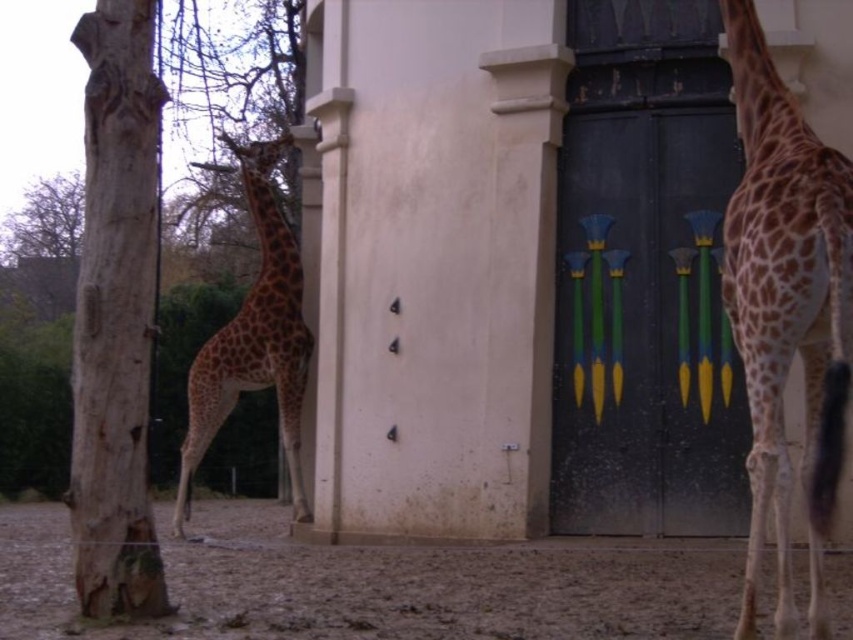
You are a zookeeper standing at the entrance of the building with the dark metal door. You need to locate the spotted brown giraffe at right. Based on its 2D coordinates, in which general direction should you look to find it?

The spotted brown giraffe at right is located at coordinates 0.483 on the x axis and 0.923 on the y axis. Since the x coordinate is closer to 0.5, it is positioned to the right side of the image. The y coordinate is closer to 1, meaning it is near the bottom of the image. Therefore, you should look to the right and slightly downward to locate the spotted brown giraffe at right.

You are a zookeeper trying to feed the giraffes. You have a bucket of food and are standing in front of the building with the distinctive door. Which giraffe is closer to the building wall? The spotted brown giraffe at right or the spotted fur giraffe at center?

A: The spotted fur giraffe at center is closer to the building wall because the spotted brown giraffe at right is positioned to its right, meaning it is farther away from the wall.